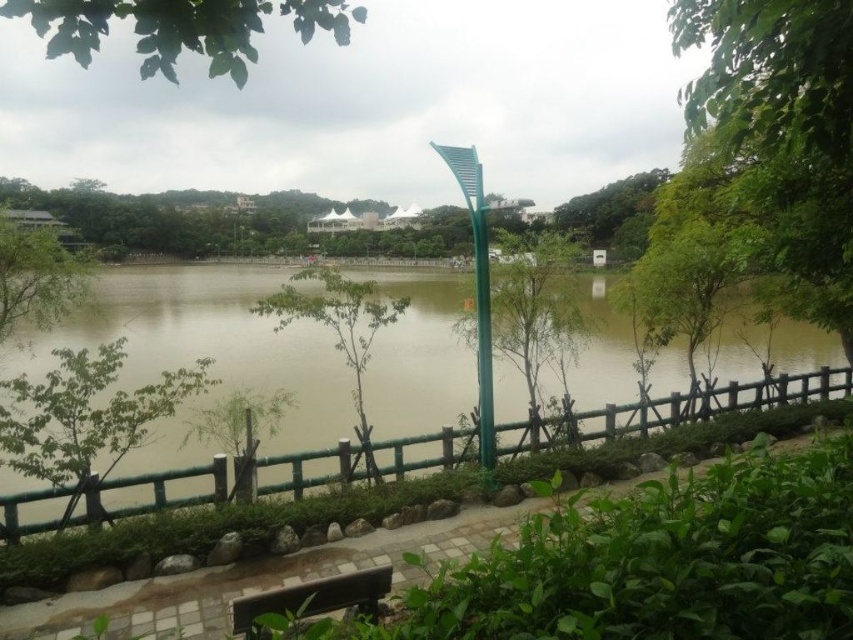
You are a park visitor trying to decide which tree to sit under for shade. The green leafy tree at lower left and the green leafy tree at left are both options. Which tree would provide more shade coverage based on their sizes?

The green leafy tree at left would provide more shade coverage since its width is greater than the green leafy tree at lower left.

You are standing on the paved pathway near the green lamppost and want to walk towards the green leafy tree at lower left and the green matte tree at center. Which tree will you reach first?

You will reach the green leafy tree at lower left first because it is closer to you than the green matte tree at center.